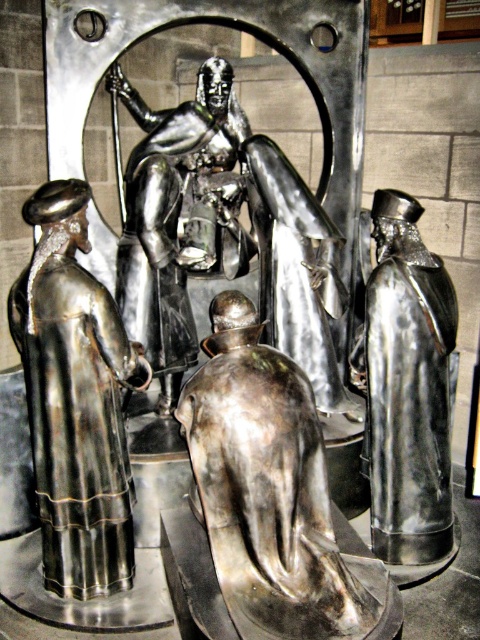
Can you confirm if polished silver robe at lower left is smaller than shiny silver figure at right?

Actually, polished silver robe at lower left might be larger than shiny silver figure at right.

Who is more forward, (58, 412) or (417, 308)?

Positioned in front is point (58, 412).

Find the location of a particular element. The height and width of the screenshot is (640, 480). polished silver robe at lower left is located at coordinates (75, 401).

Can you confirm if shiny silver figure at center is bigger than polished silver robe at lower left?

Indeed, shiny silver figure at center has a larger size compared to polished silver robe at lower left.

Does shiny silver figure at center appear over polished silver robe at lower left?

Actually, shiny silver figure at center is below polished silver robe at lower left.

Between point (205, 435) and point (128, 369), which one is positioned in front?

Point (205, 435) is more forward.

At what (x,y) coordinates should I click in order to perform the action: click on shiny silver figure at center. Please return your answer as a coordinate pair (x, y). This screenshot has width=480, height=640. Looking at the image, I should click on (268, 490).

Who is higher up, polished silver knight at center or polished silver robe at lower left?

polished silver knight at center is above.

Which is behind, point (212, 227) or point (60, 426)?

Positioned behind is point (212, 227).

Does point (301, 348) come farther from viewer compared to point (62, 544)?

Yes, point (301, 348) is farther from viewer.

Image resolution: width=480 pixels, height=640 pixels. Find the location of `polished silver knight at center`. polished silver knight at center is located at coordinates (238, 220).